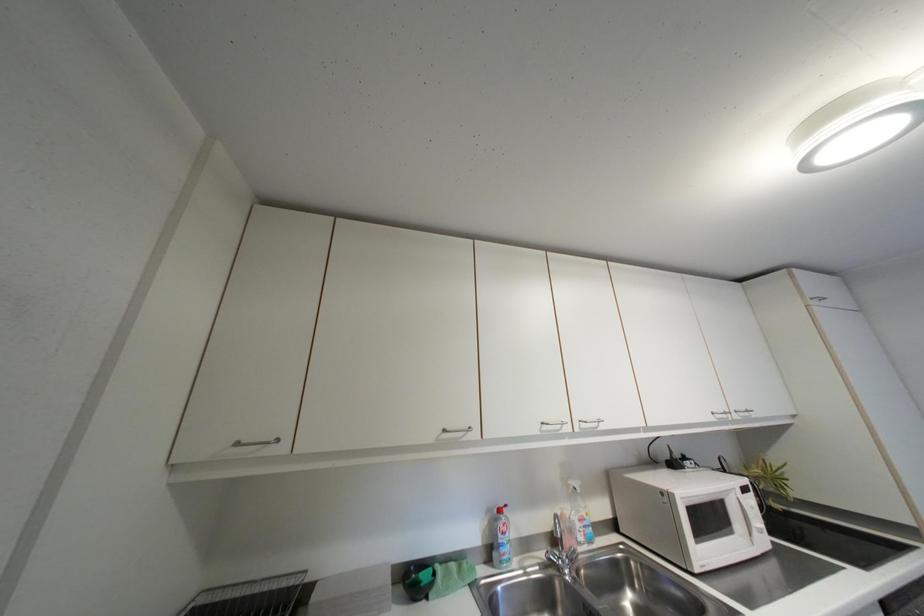
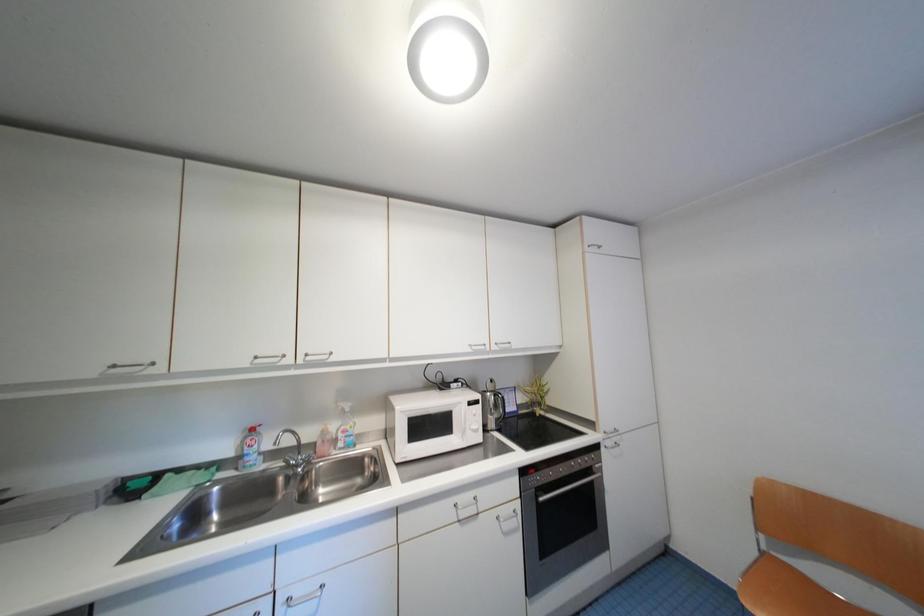
Question: The images are taken continuously from a first-person perspective. In which direction are you moving?

Choices:
 (A) Left
 (B) Right
 (C) Forward
 (D) Backward

Answer: (B)